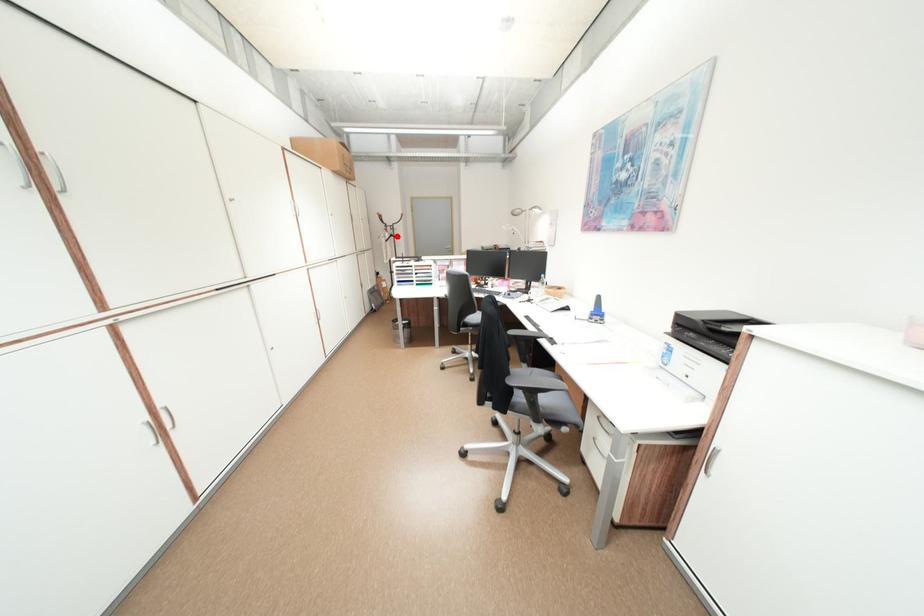
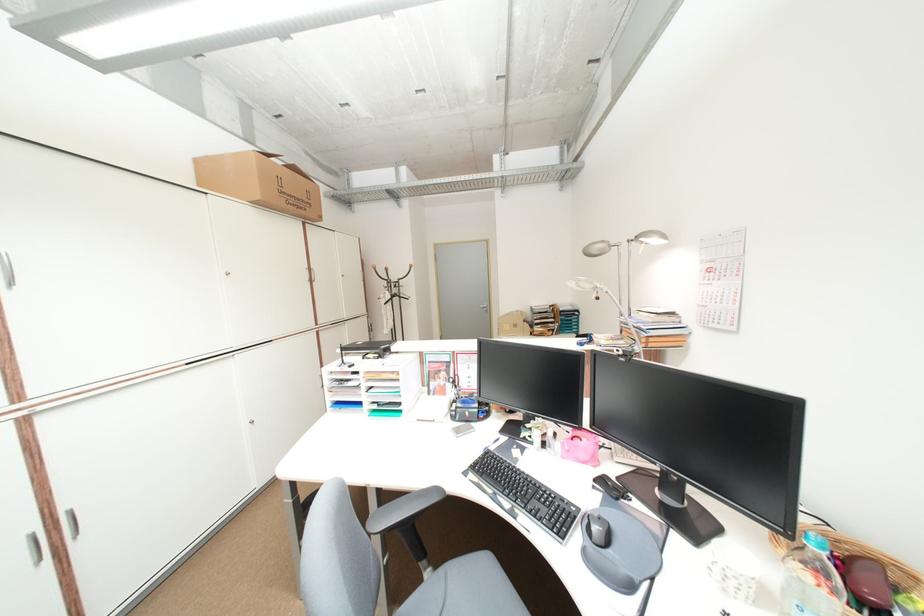
Question: I am providing you with two images of the same scene from different viewpoints. In image1, a red point is highlighted. Considering the same 3D point in image2, which of the following is correct?

Choices:
 (A) It is closer
 (B) It is farther

Answer: (B)